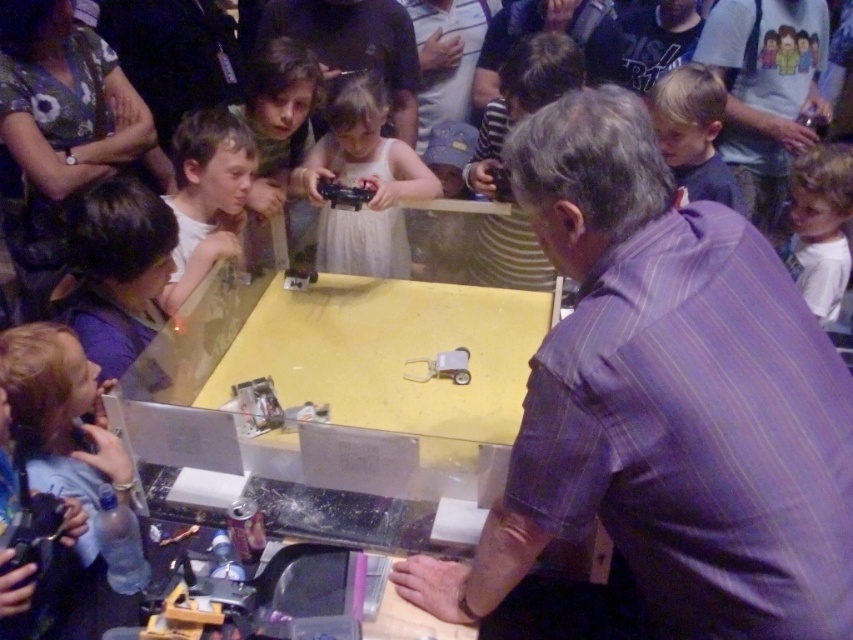
You are a photographer trying to capture a closeup of the white matte dress at center and the white cotton shirt at upper right. Since you want both subjects to be in focus, which one should you focus on first to ensure proper depth of field?

The white matte dress at center is taller than the white cotton shirt at upper right, so focusing on the white matte dress at center first will ensure proper depth of field for both subjects.

You are standing at the point marked as point (746,288) in the image. You want to reach the robot on the table without stepping on the table. Can you do it?

The point (746,288) and viewer are 36.57 inches apart from each other. Since you are already at the point, you don not need to move to reach the robot on the table.